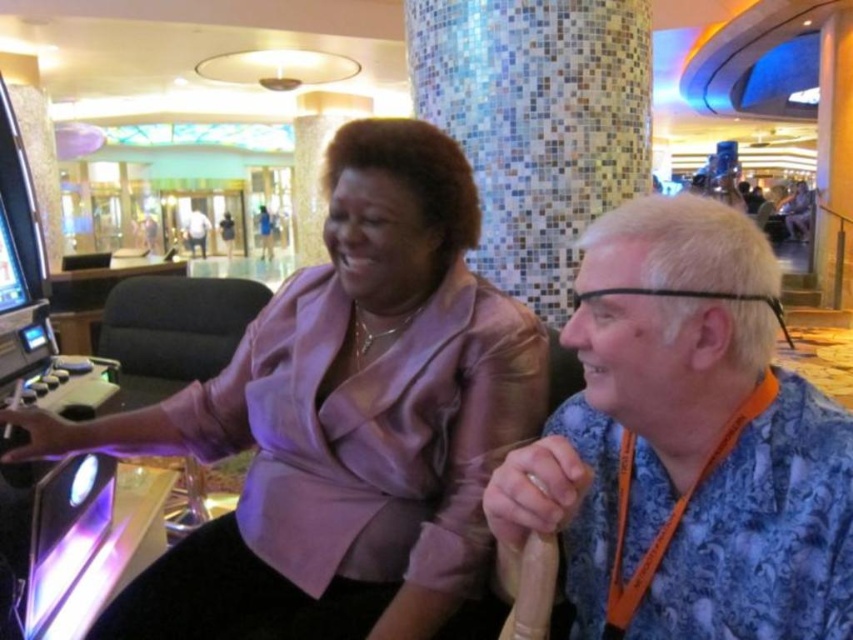
You are a photographer standing 10 feet away from the two people in the scene. You want to take a photo that includes both the matte purple blouse at center and the blue floral shirt at right without zooming in. Can you fit both subjects into the frame if your camera has a 12.5 inch wide field of view?

The matte purple blouse at center is 13.44 inches away from the blue floral shirt at right. Since the distance between them is greater than the camera field of view of 12.5 inches, you cannot fit both into the frame without zooming in.

You are a photographer trying to capture a closeup shot of the gaming console or arcade machine. You notice two points in the scene labeled as point (329, 326) and point (634, 404). Which point should you focus on to ensure the gaming console or arcade machine is in sharp focus?

You should focus on point (329, 326) because it is closer to the camera than point (634, 404), ensuring the gaming console or arcade machine will be in focus.